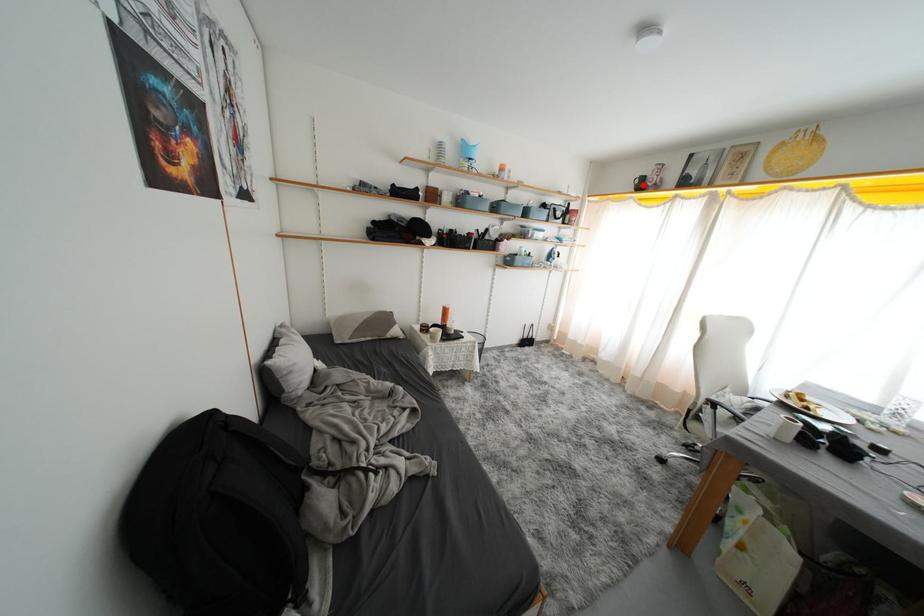
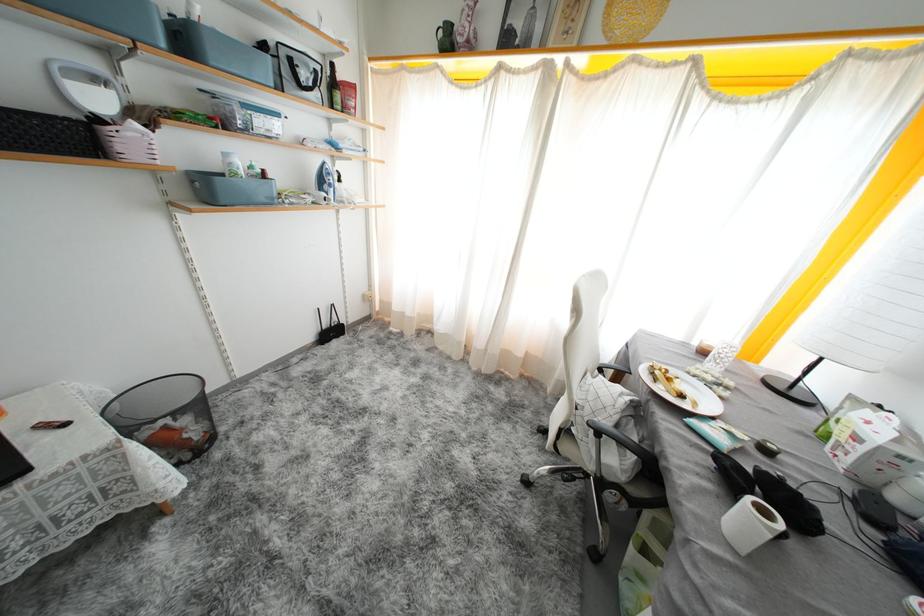
The point at the highlighted location is marked in the first image. Where is the corresponding point in the second image?

(446, 37)